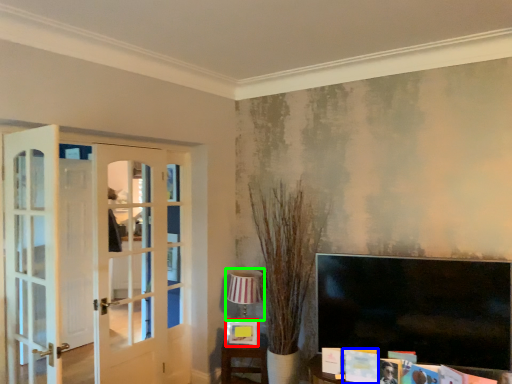
Question: Which is nearer to the picture frame (highlighted by a red box)? magazine (highlighted by a blue box) or lamp (highlighted by a green box).

Choices:
 (A) magazine
 (B) lamp

Answer: (B)